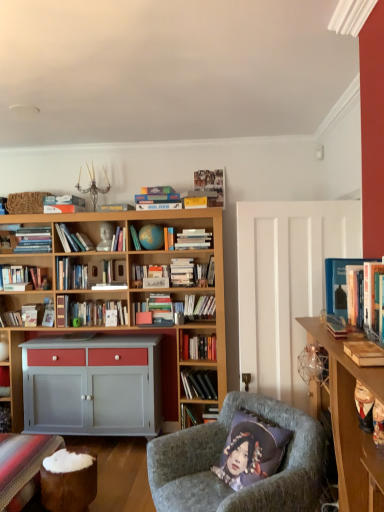
Question: From a real-world perspective, is velvet grey armchair at center on hardcover book at left, placed as the first book when sorted from left to right?

Choices:
 (A) yes
 (B) no

Answer: (B)

Question: Does velvet grey armchair at center appear on the right side of hardcover book at left, placed as the first book when sorted from left to right?

Choices:
 (A) yes
 (B) no

Answer: (A)

Question: Considering the relative sizes of velvet grey armchair at center and hardcover book at left, the 12th book positioned from the front, in the image provided, is velvet grey armchair at center smaller than hardcover book at left, the 12th book positioned from the front,?

Choices:
 (A) yes
 (B) no

Answer: (B)

Question: Can you confirm if velvet grey armchair at center is wider than hardcover book at left, the 12th book positioned from the front?

Choices:
 (A) no
 (B) yes

Answer: (B)

Question: From a real-world perspective, does velvet grey armchair at center sit lower than hardcover book at left, the 12th book positioned from the front?

Choices:
 (A) yes
 (B) no

Answer: (A)

Question: In the image, is wooden carved figurine at right, acting as the first toy starting from the back, positioned in front of or behind velvet purple pillow at lower center?

Choices:
 (A) front
 (B) behind

Answer: (A)

Question: Would you say wooden carved figurine at right, acting as the second toy starting from the front, is to the left or to the right of velvet purple pillow at lower center in the picture?

Choices:
 (A) left
 (B) right

Answer: (B)

Question: From a real-world perspective, relative to velvet purple pillow at lower center, is wooden carved figurine at right, acting as the first toy starting from the back, vertically above or below?

Choices:
 (A) below
 (B) above

Answer: (B)

Question: From the image's perspective, is wooden carved figurine at right, acting as the first toy starting from the back, above or below velvet purple pillow at lower center?

Choices:
 (A) above
 (B) below

Answer: (A)

Question: Is hardcover book at center-left, the 2th book from the back, inside or outside of hardcover books at center, which is counted as the 5th book, starting from the back?

Choices:
 (A) inside
 (B) outside

Answer: (B)

Question: Considering the relative positions of hardcover book at center-left, the eleventh book viewed from the front, and hardcover books at center, the eighth book viewed from the front, in the image provided, is hardcover book at center-left, the eleventh book viewed from the front, to the left or to the right of hardcover books at center, the eighth book viewed from the front,?

Choices:
 (A) right
 (B) left

Answer: (B)

Question: From a real-world perspective, is hardcover book at center-left, positioned as the 3th book in left-to-right order, physically located above or below hardcover books at center, the eighth book viewed from the front?

Choices:
 (A) below
 (B) above

Answer: (B)

Question: Does point (74, 272) appear closer or farther from the camera than point (203, 335)?

Choices:
 (A) closer
 (B) farther

Answer: (B)

Question: Considering the relative positions of hardcover book at center and velvet grey armchair at center in the image provided, is hardcover book at center to the left or to the right of velvet grey armchair at center?

Choices:
 (A) left
 (B) right

Answer: (A)

Question: In terms of width, does hardcover book at center look wider or thinner when compared to velvet grey armchair at center?

Choices:
 (A) wide
 (B) thin

Answer: (B)